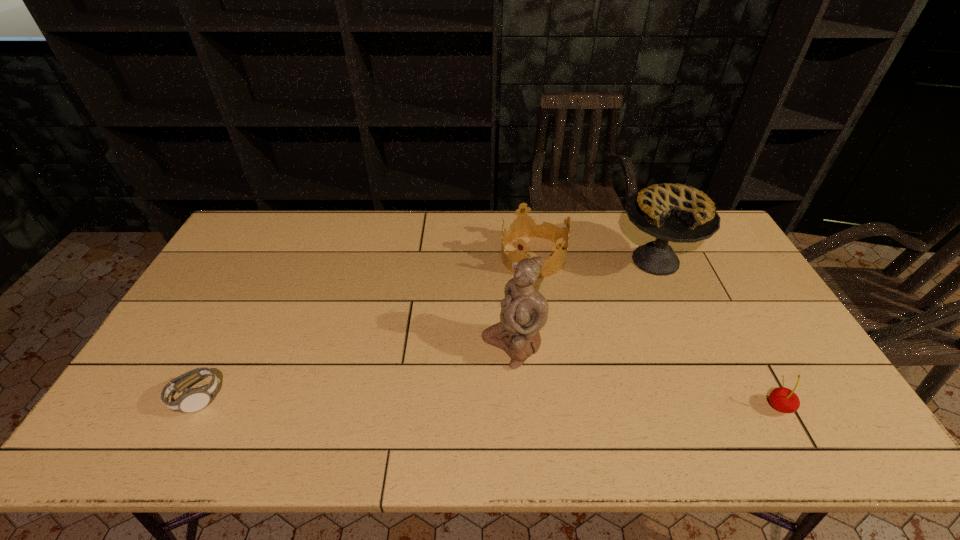
This screenshot has height=540, width=960. Find the location of `vacant space that is in between the tiara and the shortest object`. vacant space that is in between the tiara and the shortest object is located at coordinates (365, 327).

Where is `vacant space that is in between the third tallest object and the cherry`? vacant space that is in between the third tallest object and the cherry is located at coordinates (657, 332).

Point out which object is positioned as the nearest to the leftmost object. Please provide its 2D coordinates. Your answer should be formatted as a tuple, i.e. [(x, y)], where the tuple contains the x and y coordinates of a point satisfying the conditions above.

[(523, 310)]

Locate an element on the screen. This screenshot has width=960, height=540. object that stands as the closest to the third shortest object is located at coordinates (678, 213).

Find the location of a particular element. vacant region that satisfies the following two spatial constraints: 1. on the back side of the third farthest object; 2. on the left side of the pie is located at coordinates (506, 260).

This screenshot has width=960, height=540. Identify the location of free space that satisfies the following two spatial constraints: 1. on the back side of the figurine; 2. on the right side of the pie. (506, 260).